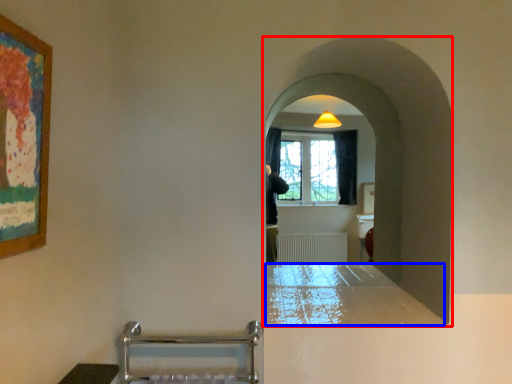
Question: Which object appears closest to the camera in this image, passage (highlighted by a red box) or counter top (highlighted by a blue box)?

Choices:
 (A) passage
 (B) counter top

Answer: (B)